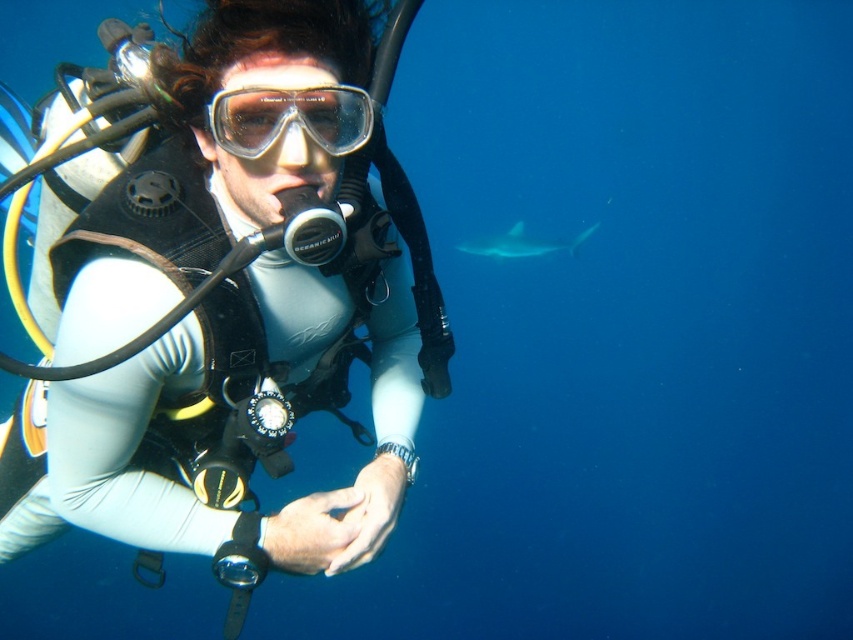
Who is taller, white matte wetsuit at center or transparent plastic goggles at center?

white matte wetsuit at center

Which is in front, point (222, 97) or point (213, 118)?

Point (222, 97) is more forward.

Identify the location of white matte wetsuit at center. tap(234, 304).

Is transparent plastic goggles at center positioned behind gray matte shark at upper right?

No, it is not.

Can you confirm if transparent plastic goggles at center is positioned to the right of gray matte shark at upper right?

In fact, transparent plastic goggles at center is to the left of gray matte shark at upper right.

Image resolution: width=853 pixels, height=640 pixels. What are the coordinates of `transparent plastic goggles at center` in the screenshot? It's located at (289, 118).

Between point (233, 518) and point (496, 253), which one is positioned in front?

Point (233, 518) is in front.

Does white matte wetsuit at center have a larger size compared to gray matte shark at upper right?

Correct, white matte wetsuit at center is larger in size than gray matte shark at upper right.

Is point (235, 269) less distant than point (527, 250)?

Yes, it is.

Locate an element on the screen. The height and width of the screenshot is (640, 853). white matte wetsuit at center is located at coordinates (234, 304).